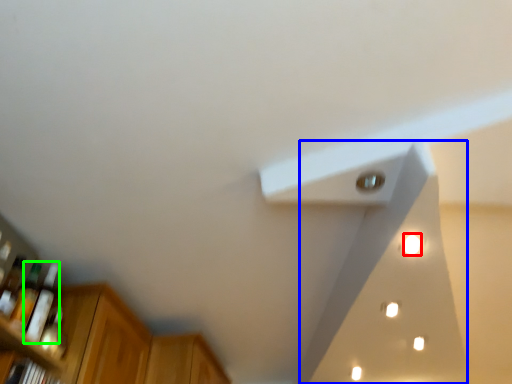
Question: Considering the real-world distances, which object is farthest from light (highlighted by a red box)? exhaust hood (highlighted by a blue box) or bottle (highlighted by a green box)?

Choices:
 (A) exhaust hood
 (B) bottle

Answer: (B)